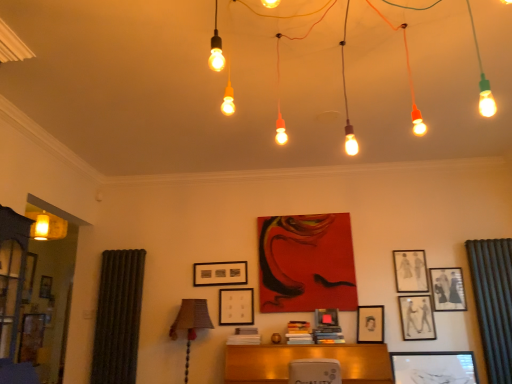
Question: Is matte black picture frame at center, which is the seventh picture frame in right-to-left order, placed right next to matte black picture frame at center, the 5th picture frame when ordered from right to left?

Choices:
 (A) yes
 (B) no

Answer: (B)

Question: Is matte black picture frame at center, which is the seventh picture frame in right-to-left order, positioned before matte black picture frame at center, the 5th picture frame when ordered from right to left?

Choices:
 (A) yes
 (B) no

Answer: (B)

Question: Considering the relative sizes of matte black picture frame at center, the first picture frame when ordered from left to right, and matte black picture frame at center, the 5th picture frame when ordered from right to left, in the image provided, is matte black picture frame at center, the first picture frame when ordered from left to right, smaller than matte black picture frame at center, the 5th picture frame when ordered from right to left,?

Choices:
 (A) no
 (B) yes

Answer: (A)

Question: Does matte black picture frame at center, which is the seventh picture frame in right-to-left order, have a greater width compared to matte black picture frame at center, the third picture frame from the left?

Choices:
 (A) yes
 (B) no

Answer: (B)

Question: Is matte black picture frame at center, the first picture frame when ordered from left to right, positioned behind matte black picture frame at center, the third picture frame from the left?

Choices:
 (A) no
 (B) yes

Answer: (B)

Question: Relative to matte black picture frame at center, which is counted as the fourth picture frame, starting from the right, is matte glass lightbulbs at upper center in front or behind?

Choices:
 (A) front
 (B) behind

Answer: (A)

Question: From the image's perspective, is matte glass lightbulbs at upper center above or below matte black picture frame at center, placed as the fourth picture frame when sorted from left to right?

Choices:
 (A) below
 (B) above

Answer: (B)

Question: Looking at their shapes, would you say matte glass lightbulbs at upper center is wider or thinner than matte black picture frame at center, which is counted as the fourth picture frame, starting from the right?

Choices:
 (A) wide
 (B) thin

Answer: (A)

Question: Does point (279, 16) appear closer or farther from the camera than point (357, 339)?

Choices:
 (A) farther
 (B) closer

Answer: (B)

Question: From a real-world perspective, is matte black picture frame at upper right, the seventh picture frame positioned from the left, above or below wooden picture frame at center, the second picture frame positioned from the left?

Choices:
 (A) below
 (B) above

Answer: (B)

Question: Looking at the image, does matte black picture frame at upper right, the first picture frame from the right, seem bigger or smaller compared to wooden picture frame at center, the second picture frame positioned from the left?

Choices:
 (A) small
 (B) big

Answer: (A)

Question: Is matte black picture frame at upper right, the seventh picture frame positioned from the left, taller or shorter than wooden picture frame at center, the second picture frame positioned from the left?

Choices:
 (A) short
 (B) tall

Answer: (B)

Question: Looking at their shapes, would you say matte black picture frame at upper right, the first picture frame from the right, is wider or thinner than wooden picture frame at center, the second picture frame positioned from the left?

Choices:
 (A) wide
 (B) thin

Answer: (B)

Question: Is matte black picture frame at center, the 5th picture frame when ordered from right to left, inside or outside of green textured curtain at right?

Choices:
 (A) inside
 (B) outside

Answer: (B)

Question: From the image's perspective, is matte black picture frame at center, the 5th picture frame when ordered from right to left, positioned above or below green textured curtain at right?

Choices:
 (A) below
 (B) above

Answer: (A)